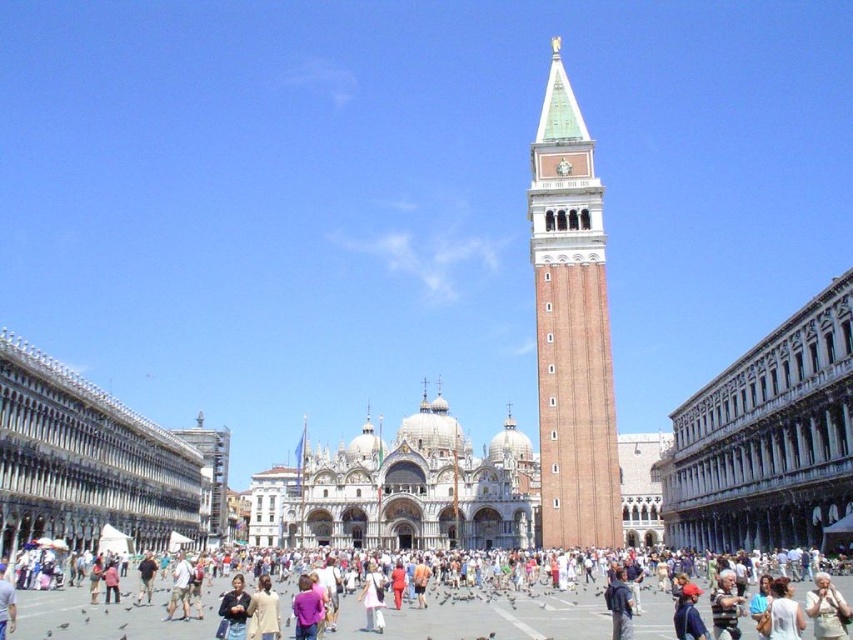
Question: Which of these objects is positioned closest to the light beige cotton shirt at center?

Choices:
 (A) brown brick tower at center
 (B) dark blue sweater at center

Answer: (B)

Question: Among these points, which one is nearest to the camera?

Choices:
 (A) (543, 620)
 (B) (596, 385)

Answer: (A)

Question: Does brown brick tower at center appear on the left side of light beige cotton shirt at center?

Choices:
 (A) yes
 (B) no

Answer: (B)

Question: Which point is farther to the camera?

Choices:
 (A) brown brick tower at center
 (B) light beige cotton shirt at center

Answer: (A)

Question: Is brown brick tower at center to the left of dark blue sweater at center from the viewer's perspective?

Choices:
 (A) no
 (B) yes

Answer: (A)

Question: Can you confirm if brown brick tower at center is positioned to the left of dark blue sweater at center?

Choices:
 (A) yes
 (B) no

Answer: (B)